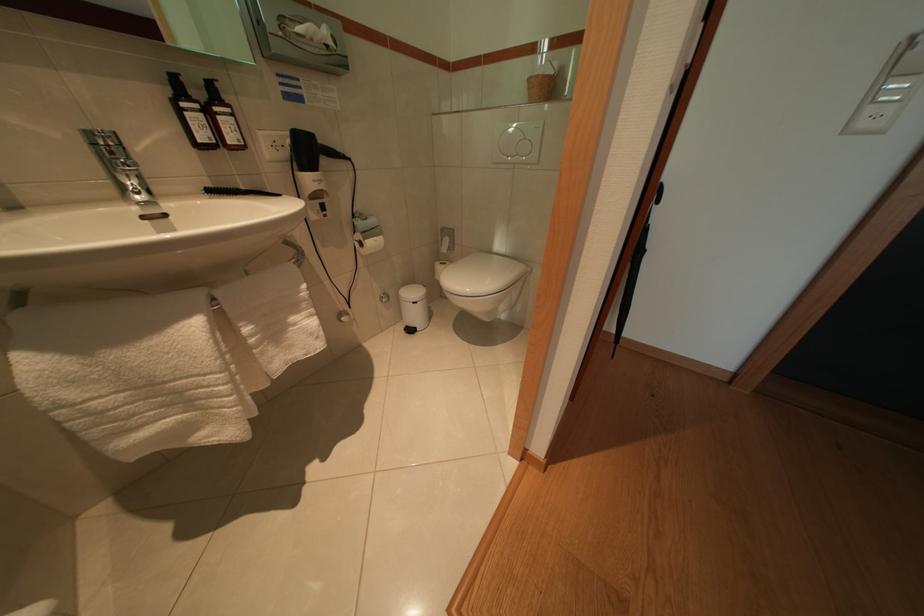
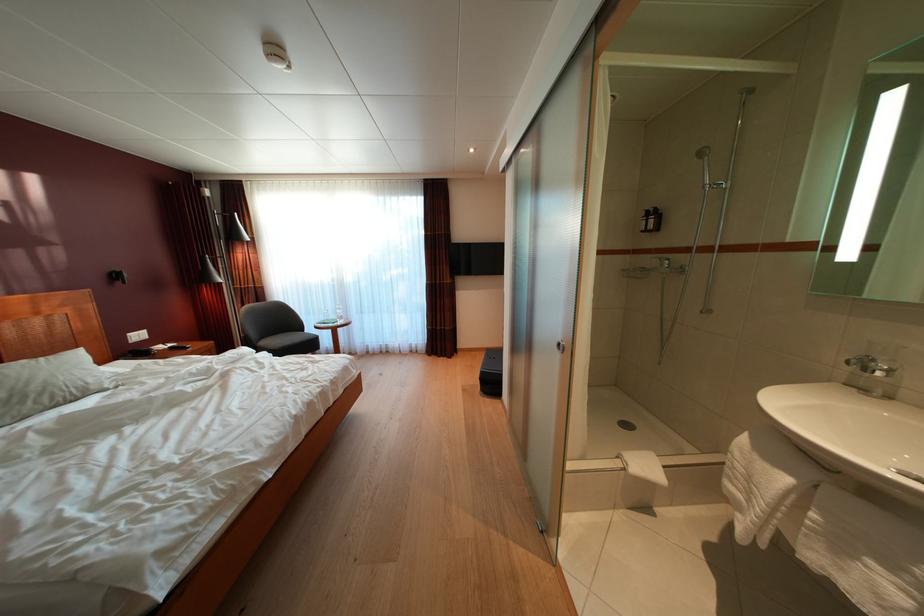
Find the pixel in the second image that matches the point at 284,339 in the first image.

(849, 554)